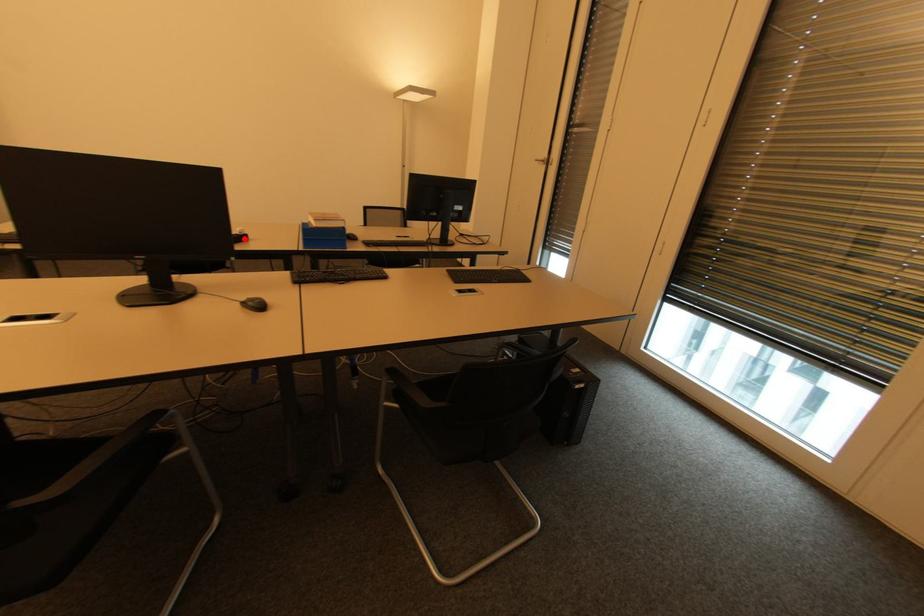
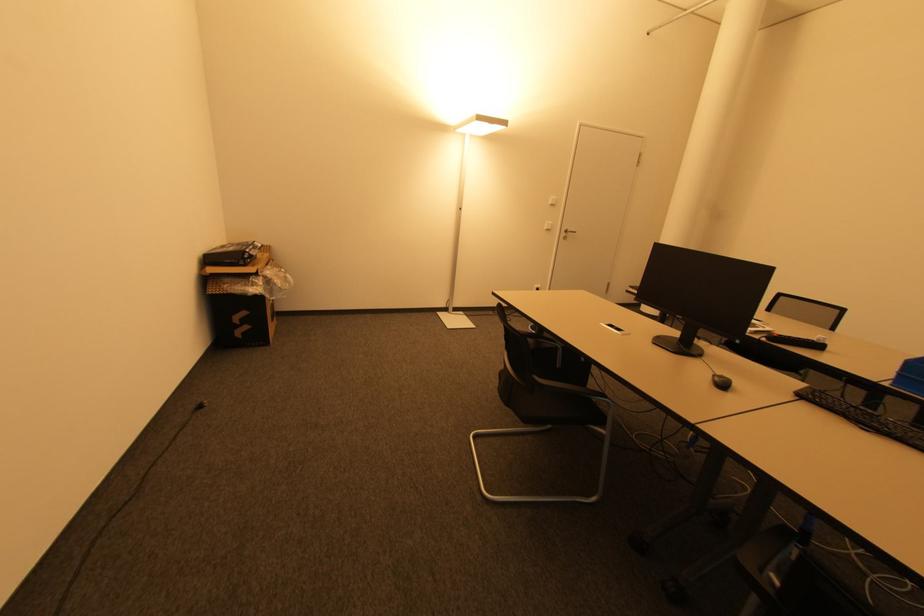
The point at the highlighted location is marked in the first image. Where is the corresponding point in the second image?

(819, 346)